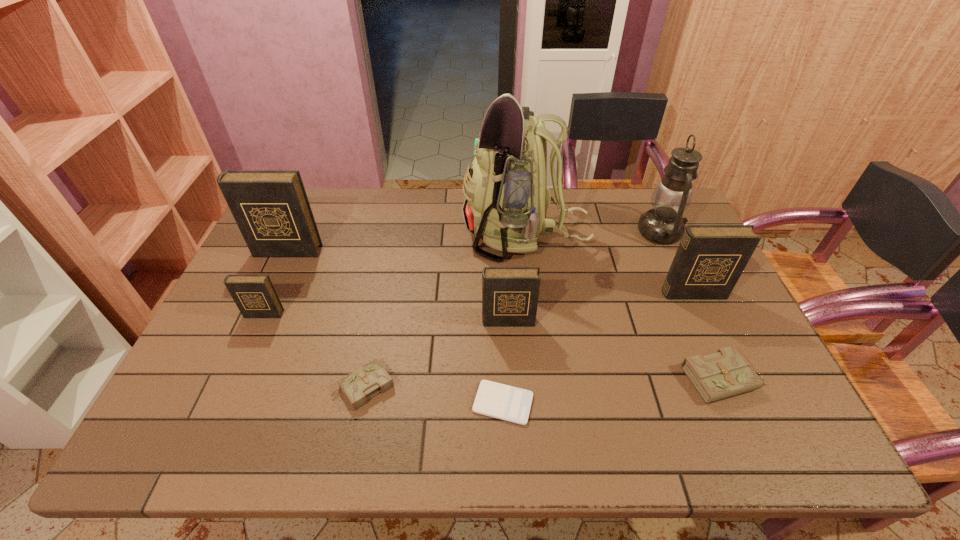
Locate an element on the screen. oil lamp that is at the right edge is located at coordinates (663, 224).

In order to click on object situated at the far right corner in this screenshot , I will do `click(663, 224)`.

Where is `free space at the far edge of the desktop`? This screenshot has height=540, width=960. free space at the far edge of the desktop is located at coordinates [340, 192].

Find the location of a particular element. vacant region at the near edge of the desktop is located at coordinates (583, 422).

Locate an element on the screen. This screenshot has height=540, width=960. vacant space at the left edge is located at coordinates (246, 340).

Identify the location of free space at the right edge of the desktop. The image size is (960, 540). (701, 339).

Identify the location of vacant space at the far left corner of the desktop. (320, 219).

In order to click on free region at the near right corner of the desktop in this screenshot , I will do `click(735, 452)`.

Find the location of a particular element. vacant region between the oil lamp and the biggest dark diary is located at coordinates (473, 241).

Identify the location of empty space that is in between the fourth tallest diary and the third tallest diary. This screenshot has height=540, width=960. (386, 318).